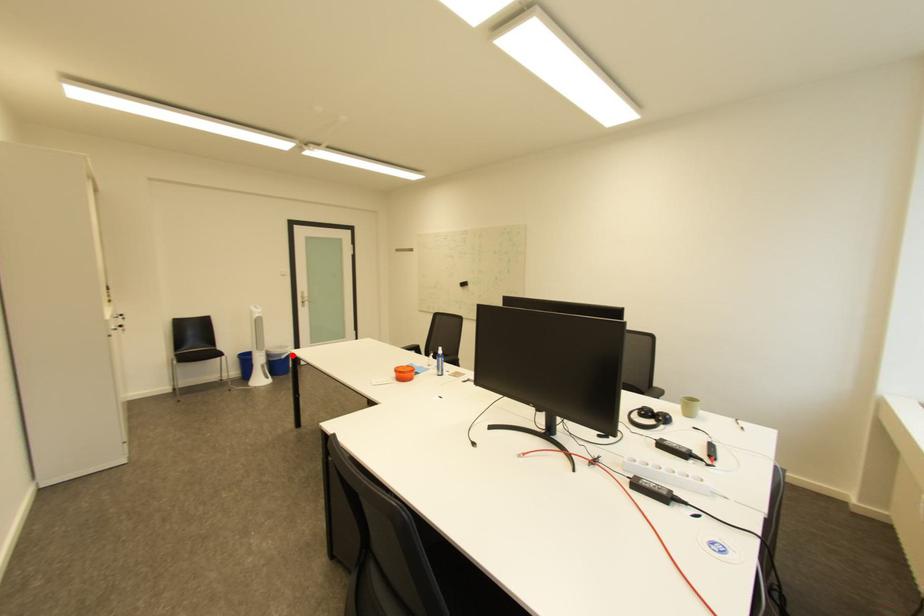
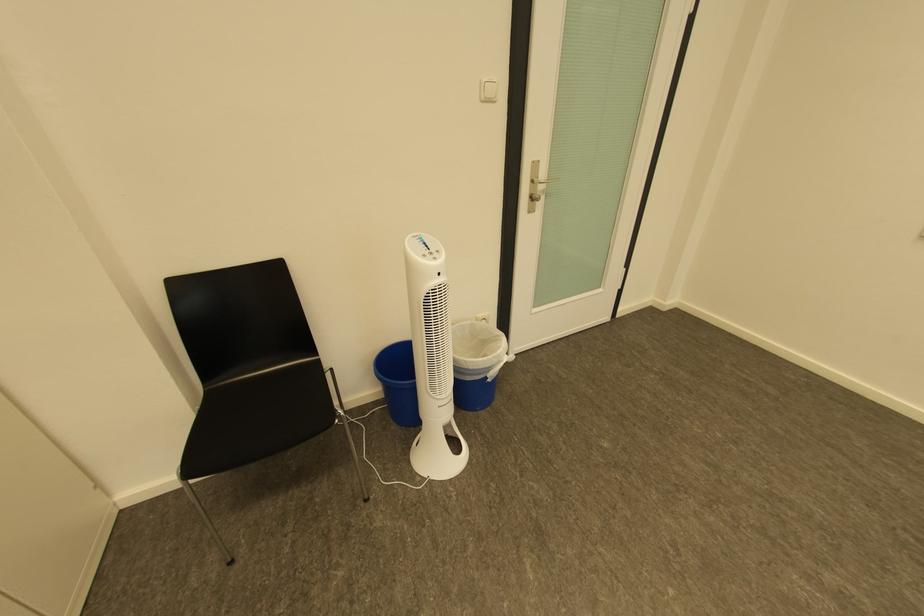
In the second image, find the point that corresponds to the highlighted location in the first image.

(499, 370)